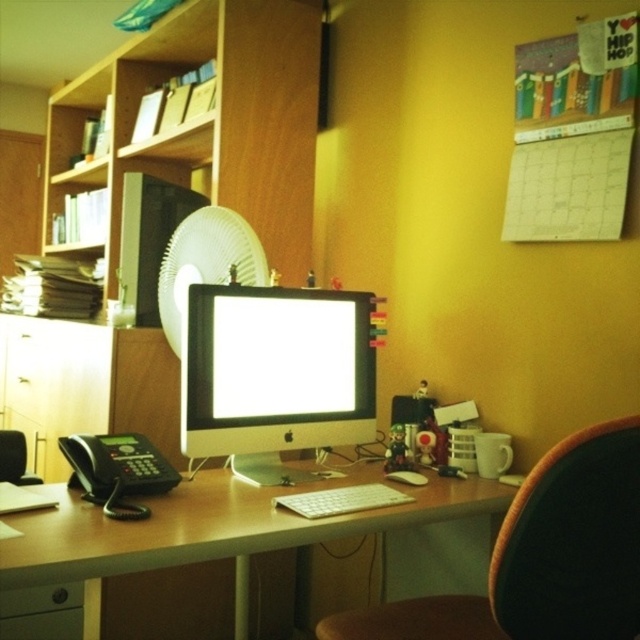
Based on the photo, you are a delivery person who needs to place a large package on the desk. The package is as big as the black leather swivel chair at center. Can you fit the package on the white plastic computer desk at center without removing any items?

The black leather swivel chair at center is smaller than the white plastic computer desk at center. Since the package is as big as the chair, there should be enough space on the desk to accommodate it without needing to remove any items.

Looking at this image, what object is located at the coordinates point (205, 262) in the image?

The white plastic fan at center is located at point (205, 262).

You are a delivery person trying to place a package that is 7 feet long on the wooden bookshelf at upper left. Can the package fit on the shelf?

The wooden bookshelf at upper left is 7.36 feet from camera, so the package that is 7 feet long can fit on the shelf since it is shorter than the shelf length.